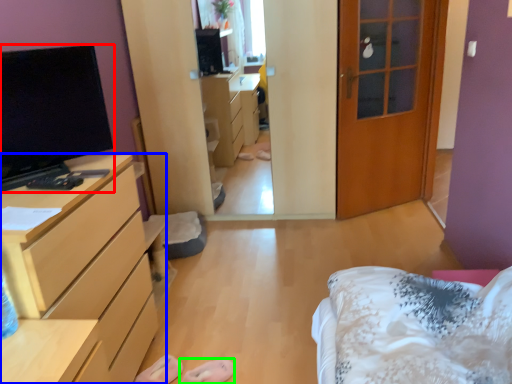
Question: Which object is the farthest from television (highlighted by a red box)? Choose among these: chest of drawers (highlighted by a blue box) or shoe (highlighted by a green box).

Choices:
 (A) chest of drawers
 (B) shoe

Answer: (B)